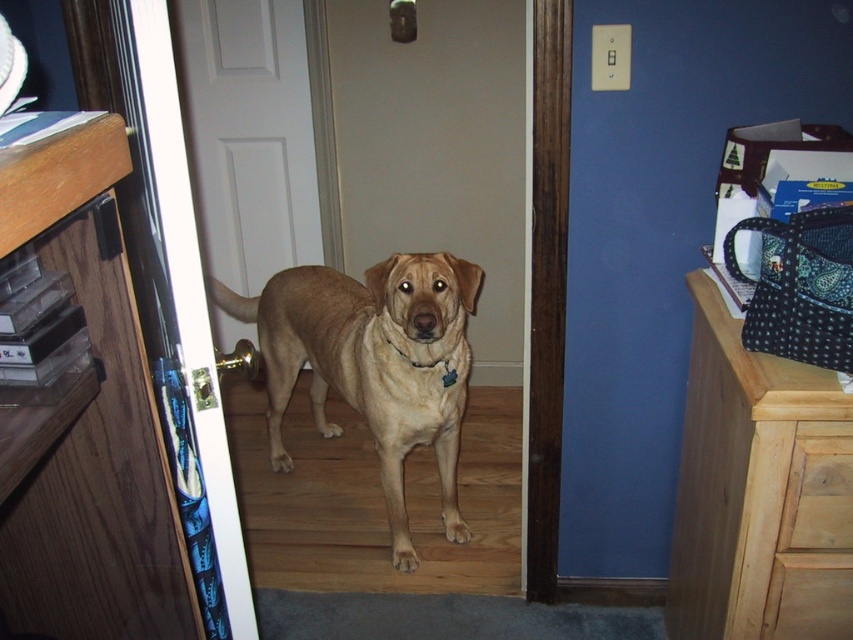
Question: Which point is farther to the camera?

Choices:
 (A) wooden dresser at left
 (B) golden tan fur at center
 (C) black leather neckband at center

Answer: (C)

Question: Considering the real-world distances, which object is farthest from the golden tan fur at center?

Choices:
 (A) wooden dresser at right
 (B) black leather neckband at center
 (C) wooden dresser at left

Answer: (C)

Question: Is the position of wooden dresser at left more distant than that of black leather neckband at center?

Choices:
 (A) no
 (B) yes

Answer: (A)

Question: Which object is farther from the camera taking this photo?

Choices:
 (A) wooden dresser at left
 (B) black leather neckband at center
 (C) golden tan fur at center

Answer: (B)

Question: Is wooden dresser at right to the left of golden tan fur at center from the viewer's perspective?

Choices:
 (A) yes
 (B) no

Answer: (B)

Question: Does wooden dresser at right have a smaller size compared to black leather neckband at center?

Choices:
 (A) no
 (B) yes

Answer: (A)